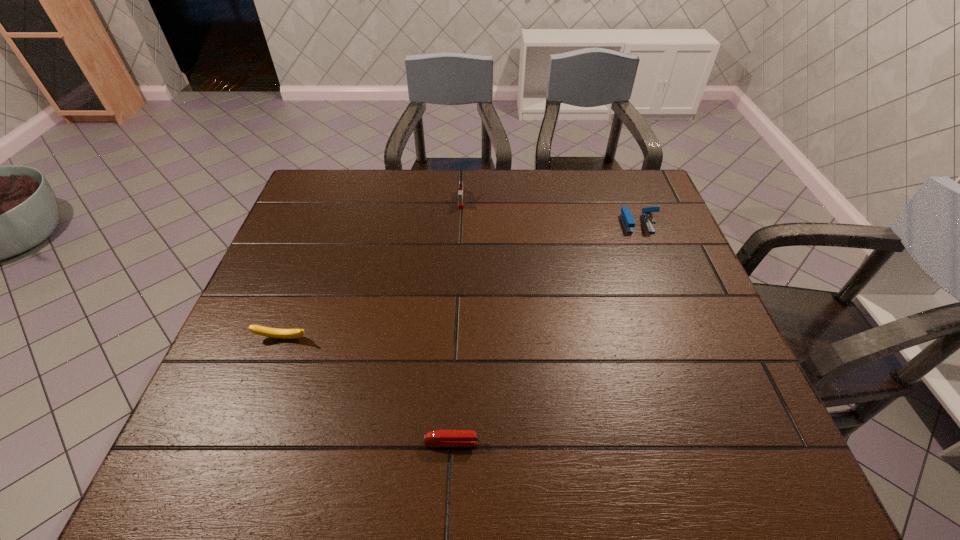
Locate an element on the screen. vacant point located between the third farthest object and the nearest stapler is located at coordinates (367, 390).

Identify which object is the second closest to the farthest object. Please provide its 2D coordinates. Your answer should be formatted as a tuple, i.e. [(x, y)], where the tuple contains the x and y coordinates of a point satisfying the conditions above.

[(256, 329)]

Identify the location of object that is the second closest to the banana. This screenshot has height=540, width=960. (460, 192).

Select which stapler is the closest to the second farthest object. Please provide its 2D coordinates. Your answer should be formatted as a tuple, i.e. [(x, y)], where the tuple contains the x and y coordinates of a point satisfying the conditions above.

[(460, 192)]

Point out which stapler is positioned as the nearest to the farthest stapler. Please provide its 2D coordinates. Your answer should be formatted as a tuple, i.e. [(x, y)], where the tuple contains the x and y coordinates of a point satisfying the conditions above.

[(626, 216)]

Identify the location of vacant region that satisfies the following two spatial constraints: 1. on the handle side of the second farthest stapler; 2. on the left side of the farthest object. The width and height of the screenshot is (960, 540). (460, 223).

Locate an element on the screen. free spot that satisfies the following two spatial constraints: 1. on the handle side of the farthest object; 2. on the right side of the rightmost stapler is located at coordinates (460, 223).

At what (x,y) coordinates should I click in order to perform the action: click on free space that satisfies the following two spatial constraints: 1. on the handle side of the third nearest object; 2. on the left side of the farthest stapler. Please return your answer as a coordinate pair (x, y). This screenshot has width=960, height=540. Looking at the image, I should click on (460, 223).

Locate an element on the screen. The height and width of the screenshot is (540, 960). free region that satisfies the following two spatial constraints: 1. on the handle side of the farthest object; 2. on the left side of the second shortest stapler is located at coordinates click(460, 223).